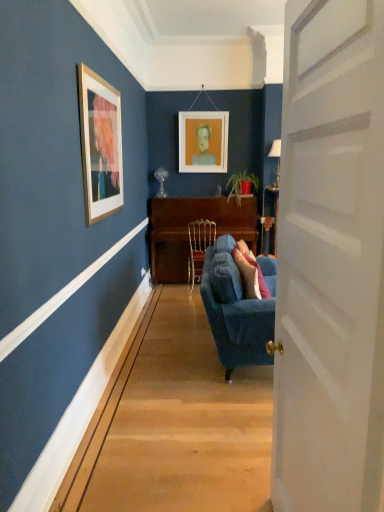
Question: Is wooden polished desk at center bigger or smaller than velvet blue couch at center?

Choices:
 (A) big
 (B) small

Answer: (B)

Question: Is wooden polished desk at center inside the boundaries of velvet blue couch at center, or outside?

Choices:
 (A) inside
 (B) outside

Answer: (B)

Question: Estimate the real-world distances between objects in this image. Which object is farther from the metallic silver lamp at right, the second lamp when ordered from back to front?

Choices:
 (A) green matte plant at center
 (B) wooden polished desk at center
 (C) matte white picture frame at upper center
 (D) velvet blue couch at center
 (E) matte glass lamp at upper center, the 1th lamp from the left

Answer: (D)

Question: Which object is positioned closest to the gold metallic chair at center?

Choices:
 (A) metallic silver lamp at right, the first lamp in the right-to-left sequence
 (B) matte white picture frame at upper center
 (C) green matte plant at center
 (D) white wooden door at right
 (E) matte glass lamp at upper center, the 1th lamp from the left

Answer: (C)